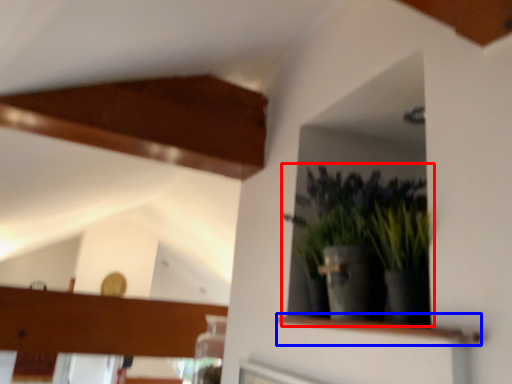
Question: Which object appears closest to the camera in this image, houseplant (highlighted by a red box) or shelf (highlighted by a blue box)?

Choices:
 (A) houseplant
 (B) shelf

Answer: (B)